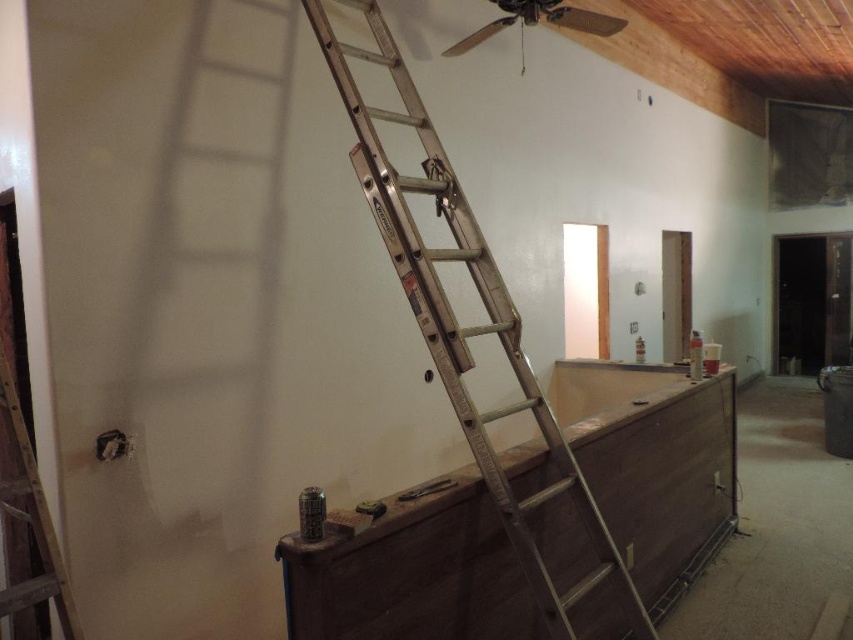
Looking at this image, who is positioned more to the left, metallic silver ladder at left or metallic ceiling fan at upper center?

metallic silver ladder at left is more to the left.

How far apart are metallic silver ladder at left and metallic ceiling fan at upper center?

A distance of 2.89 meters exists between metallic silver ladder at left and metallic ceiling fan at upper center.

Is point (7, 417) positioned in front of point (527, 1)?

Yes, point (7, 417) is closer to viewer.

You are a GUI agent. You are given a task and a screenshot of the screen. Output one action in this format:
    pyautogui.click(x=<x>, y=<y>)
    Task: Click on the metallic silver ladder at left
    The image size is (853, 640).
    Given the screenshot: What is the action you would take?
    pyautogui.click(x=32, y=516)

Is brown wood dresser at center positioned in front of metallic silver ladder at left?

No, it is behind metallic silver ladder at left.

From the picture: Is brown wood dresser at center smaller than metallic silver ladder at left?

No, brown wood dresser at center is not smaller than metallic silver ladder at left.

What do you see at coordinates (654, 465) in the screenshot?
I see `brown wood dresser at center` at bounding box center [654, 465].

Find the location of a particular element. The height and width of the screenshot is (640, 853). brown wood dresser at center is located at coordinates (654, 465).

Is point (569, 536) positioned before point (508, 12)?

Yes, point (569, 536) is in front of point (508, 12).

Between brown wood dresser at center and metallic ceiling fan at upper center, which one has more height?

With more height is brown wood dresser at center.

The image size is (853, 640). Describe the element at coordinates (654, 465) in the screenshot. I see `brown wood dresser at center` at that location.

Image resolution: width=853 pixels, height=640 pixels. Identify the location of brown wood dresser at center. (654, 465).